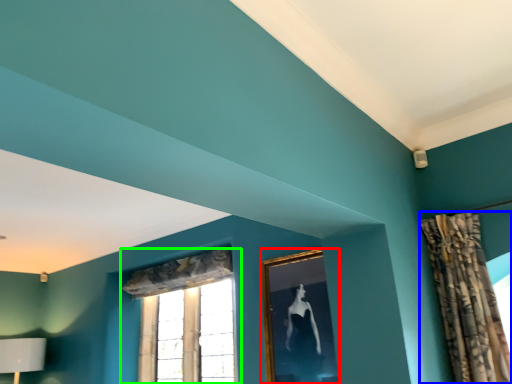
Question: Which object is the closest to the picture frame (highlighted by a red box)? Choose among these: curtain (highlighted by a blue box) or window (highlighted by a green box).

Choices:
 (A) curtain
 (B) window

Answer: (A)